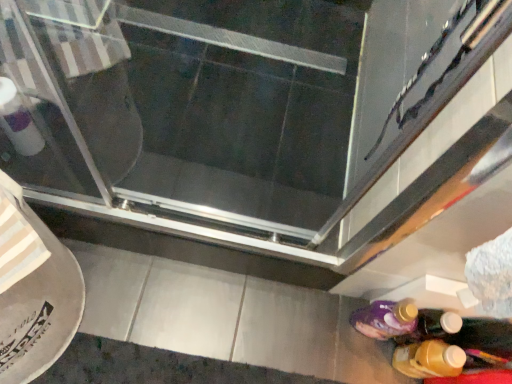
Question: From the image's perspective, would you say translucent plastic bottle at lower right is shown under transparent glass screen door at center?

Choices:
 (A) yes
 (B) no

Answer: (A)

Question: From a real-world perspective, is translucent plastic bottle at lower right physically above transparent glass screen door at center?

Choices:
 (A) no
 (B) yes

Answer: (A)

Question: Is translucent plastic bottle at lower right positioned with its back to transparent glass screen door at center?

Choices:
 (A) yes
 (B) no

Answer: (B)

Question: Considering the relative positions of translucent plastic bottle at lower right and transparent glass screen door at center in the image provided, is translucent plastic bottle at lower right to the left of transparent glass screen door at center from the viewer's perspective?

Choices:
 (A) no
 (B) yes

Answer: (A)

Question: From the image's perspective, does translucent plastic bottle at lower right appear higher than transparent glass screen door at center?

Choices:
 (A) no
 (B) yes

Answer: (A)

Question: Can you confirm if translucent plastic bottle at lower right is thinner than transparent glass screen door at center?

Choices:
 (A) no
 (B) yes

Answer: (B)

Question: From a real-world perspective, is transparent glass screen door at center located higher than translucent plastic bottle at lower right?

Choices:
 (A) no
 (B) yes

Answer: (B)

Question: From the image's perspective, is transparent glass screen door at center located beneath translucent plastic bottle at lower right?

Choices:
 (A) no
 (B) yes

Answer: (A)

Question: Considering the relative sizes of transparent glass screen door at center and translucent plastic bottle at lower right in the image provided, is transparent glass screen door at center thinner than translucent plastic bottle at lower right?

Choices:
 (A) no
 (B) yes

Answer: (A)

Question: From a real-world perspective, is transparent glass screen door at center positioned under translucent plastic bottle at lower right based on gravity?

Choices:
 (A) no
 (B) yes

Answer: (A)

Question: Is transparent glass screen door at center aimed at translucent plastic bottle at lower right?

Choices:
 (A) yes
 (B) no

Answer: (B)

Question: Are transparent glass screen door at center and translucent plastic bottle at lower right beside each other?

Choices:
 (A) no
 (B) yes

Answer: (A)

Question: Would you say transparent glass screen door at center is to the left or to the right of translucent plastic bottle at lower right in the picture?

Choices:
 (A) left
 (B) right

Answer: (A)